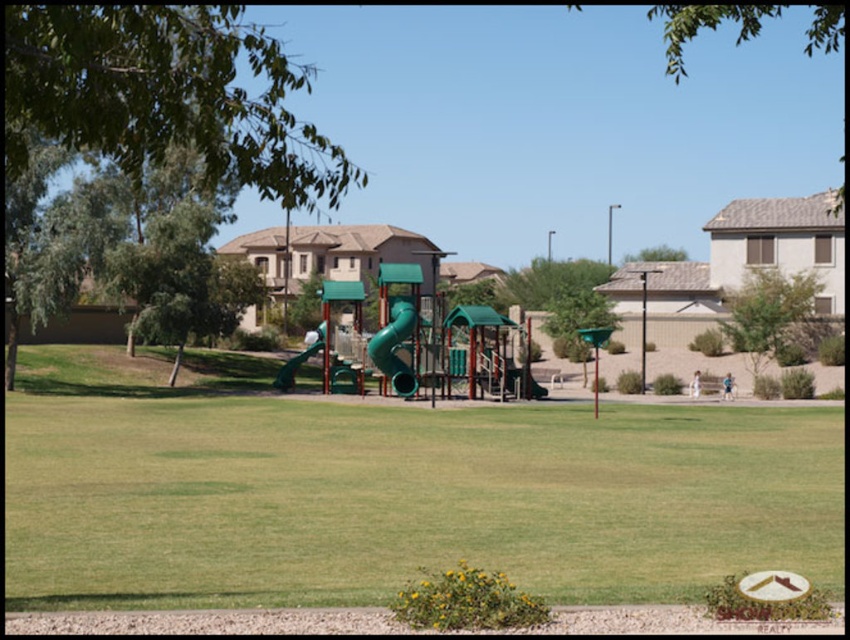
You are standing at the point labeled point [392,492] in the suburban park scene. What is the immediate surface you are standing on?

The point [392,492] corresponds to green grass at center, so you are standing on green grass at center.

You are a parent trying to decide which slide to let your child play on. Both the green matte slide at center and the green rubber slide at center are available. Which one is taller?

The green matte slide at center is taller than the green rubber slide at center according to the description.